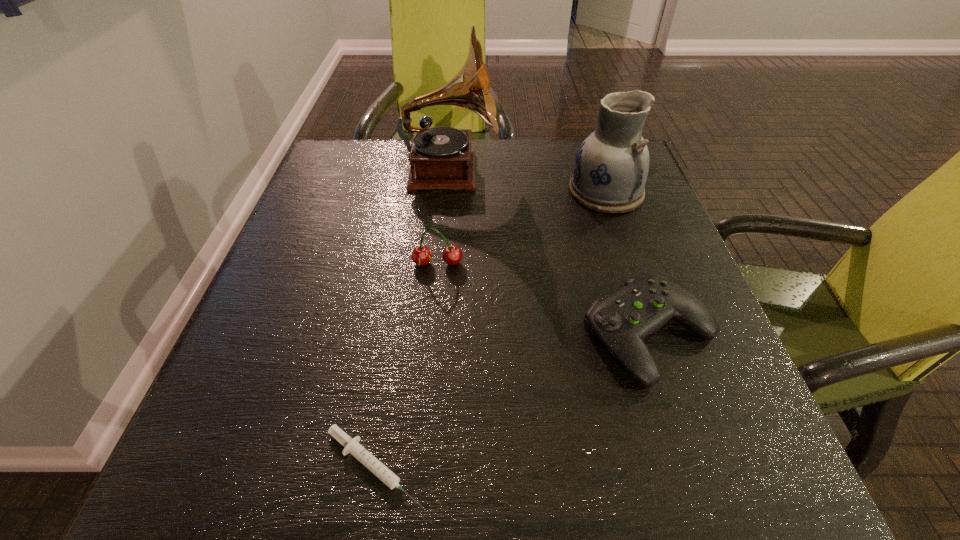
What are the coordinates of `phonograph_record` in the screenshot? It's located at (440, 157).

This screenshot has height=540, width=960. Identify the location of the fourth shortest object. (611, 167).

In order to click on cherry in this screenshot , I will do `click(421, 255)`.

This screenshot has height=540, width=960. Identify the location of the third shortest object. (x=421, y=255).

Identify the location of control. (647, 302).

You are a GUI agent. You are given a task and a screenshot of the screen. Output one action in this format:
    pyautogui.click(x=<x>, y=<y>)
    Task: Click on the fourth tallest object
    The image size is (960, 540).
    Given the screenshot: What is the action you would take?
    pyautogui.click(x=647, y=302)

At what (x,y) coordinates should I click in order to perform the action: click on syringe. Please return your answer as a coordinate pair (x, y). The image size is (960, 540). Looking at the image, I should click on (352, 446).

At what (x,y) coordinates should I click in order to perform the action: click on the shortest object. Please return your answer as a coordinate pair (x, y). Image resolution: width=960 pixels, height=540 pixels. Looking at the image, I should click on pyautogui.click(x=352, y=446).

Where is `vacant position located 0.330m on the horn of the phonograph_record`? vacant position located 0.330m on the horn of the phonograph_record is located at coordinates (630, 173).

Locate an element on the screen. The width and height of the screenshot is (960, 540). vacant space located on the back of the pottery is located at coordinates (595, 160).